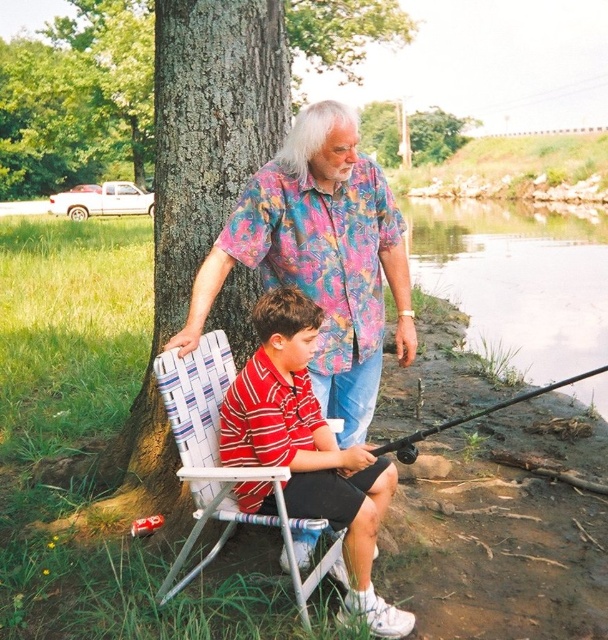
You are planning to take a photo of the green rough bark tree at center and the white woven folding chair at center. Which object should you focus on first if you want to capture both in a single frame without moving the camera?

You should focus on the green rough bark tree at center first because it is larger in size than the white woven folding chair at center, making it the more prominent subject in the scene.